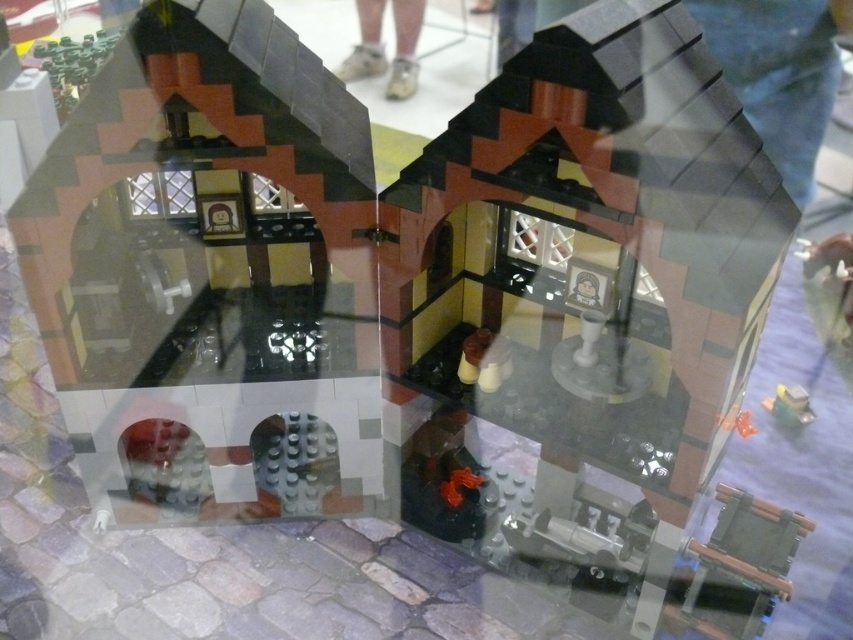
Question: Which of these objects is positioned farthest from the matte brick house at center?

Choices:
 (A) white leather shoes at center
 (B) matte black building at center

Answer: (A)

Question: Does matte brick house at center have a larger size compared to white leather shoes at center?

Choices:
 (A) no
 (B) yes

Answer: (B)

Question: Among these points, which one is farthest from the camera?

Choices:
 (A) (589, 275)
 (B) (381, 19)
 (C) (65, 396)

Answer: (B)

Question: Considering the relative positions of matte brick house at center and white leather shoes at center in the image provided, where is matte brick house at center located with respect to white leather shoes at center?

Choices:
 (A) above
 (B) below

Answer: (B)

Question: Which object appears closest to the camera in this image?

Choices:
 (A) matte black building at center
 (B) matte brick house at center

Answer: (B)

Question: Can you confirm if matte black building at center is positioned above white leather shoes at center?

Choices:
 (A) yes
 (B) no

Answer: (B)